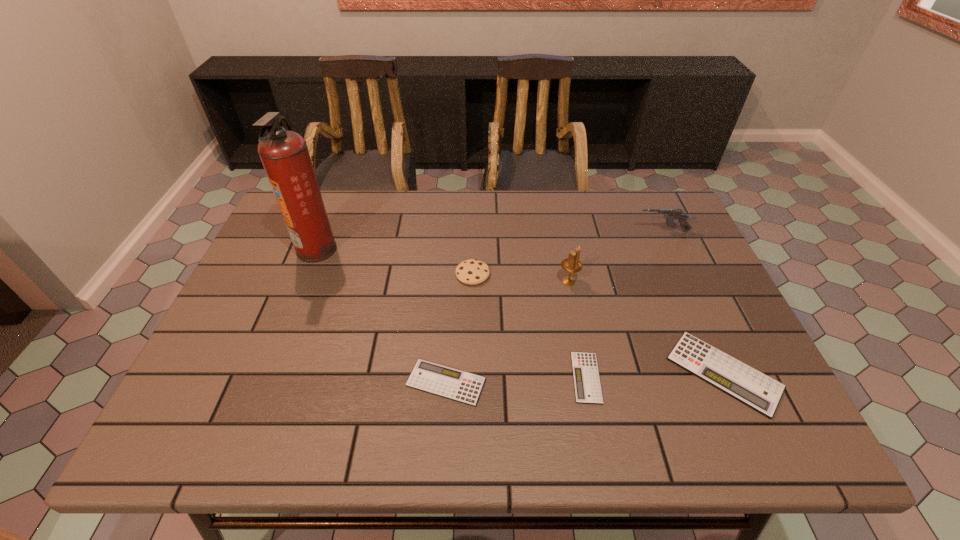
Identify the location of blank region between the fifth tallest object and the cookie. This screenshot has width=960, height=540. (598, 323).

Image resolution: width=960 pixels, height=540 pixels. I want to click on blank region between the sixth shortest object and the fourth tallest object, so click(520, 278).

Choose which object is the fifth nearest neighbor to the cookie. Please provide its 2D coordinates. Your answer should be formatted as a tuple, i.e. [(x, y)], where the tuple contains the x and y coordinates of a point satisfying the conditions above.

[(749, 386)]

This screenshot has height=540, width=960. In order to click on object that is the fourth closest to the second tallest calculator in this screenshot , I will do `click(284, 154)`.

What are the coordinates of `calculator that can be found as the closest to the fifth shortest object` in the screenshot? It's located at (749, 386).

I want to click on calculator that stands as the closest to the second calculator from left to right, so click(x=749, y=386).

You are a GUI agent. You are given a task and a screenshot of the screen. Output one action in this format:
    pyautogui.click(x=<x>, y=<y>)
    Task: Click on the vacant area that satisfies the following two spatial constraints: 1. at the nozzle of the rightmost calculator; 2. on the right side of the leftmost object
    
    Given the screenshot: What is the action you would take?
    pyautogui.click(x=268, y=373)

You are a GUI agent. You are given a task and a screenshot of the screen. Output one action in this format:
    pyautogui.click(x=<x>, y=<y>)
    Task: Click on the vacant space that satisfies the following two spatial constraints: 1. at the nozzle of the leftmost object; 2. on the right side of the second shortest object
    
    Given the screenshot: What is the action you would take?
    pyautogui.click(x=264, y=382)

Where is `blank space that satisfies the following two spatial constraints: 1. at the nozzle of the second calculator from left to right; 2. on the left side of the tallest object`? Image resolution: width=960 pixels, height=540 pixels. blank space that satisfies the following two spatial constraints: 1. at the nozzle of the second calculator from left to right; 2. on the left side of the tallest object is located at coordinates click(266, 377).

Where is `vacant space that satisfies the following two spatial constraints: 1. at the nozzle of the second shortest calculator; 2. on the left side of the fire extinguisher`? The height and width of the screenshot is (540, 960). vacant space that satisfies the following two spatial constraints: 1. at the nozzle of the second shortest calculator; 2. on the left side of the fire extinguisher is located at coordinates (264, 382).